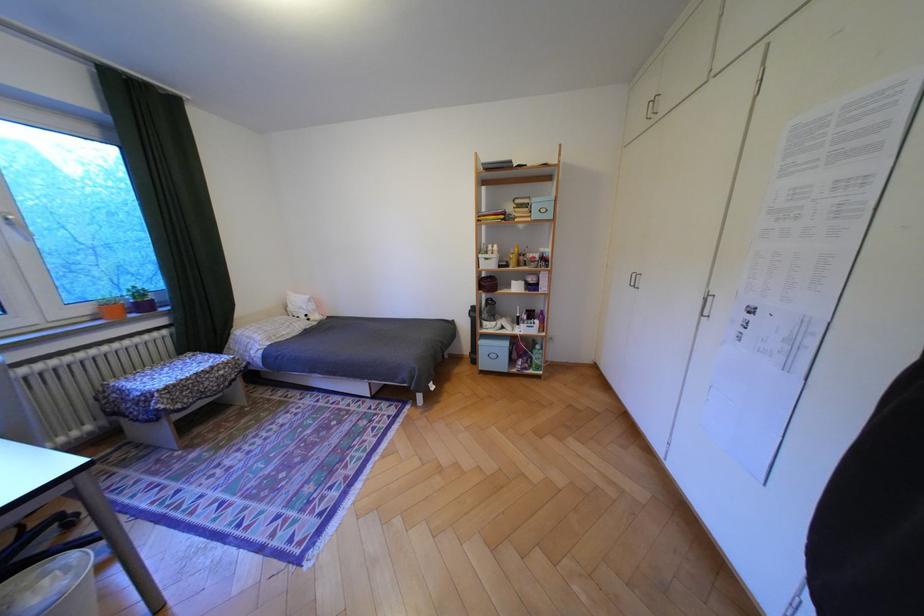
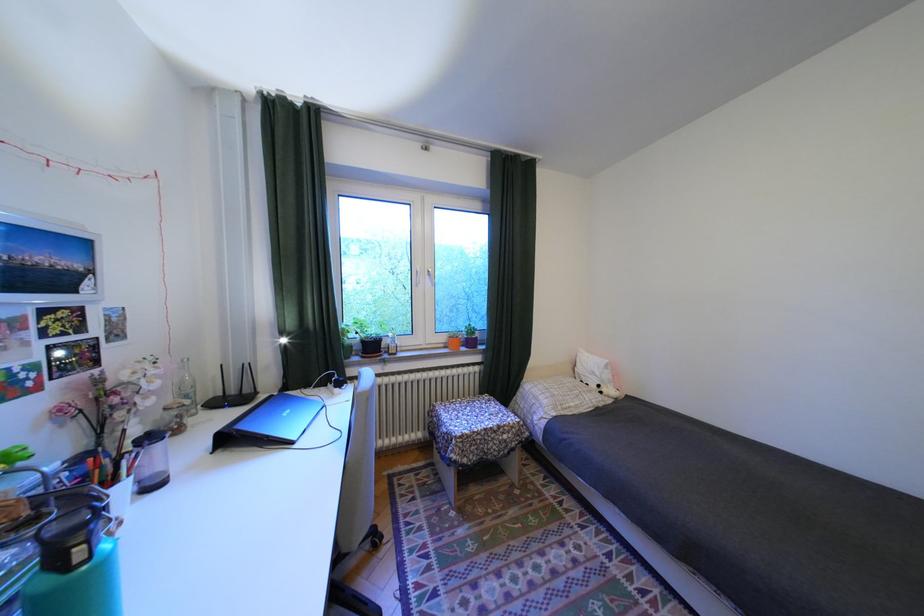
Question: The first image is from the beginning of the video and the second image is from the end. How did the camera likely rotate when shooting the video?

Choices:
 (A) Left
 (B) Right
 (C) Up
 (D) Down

Answer: (A)